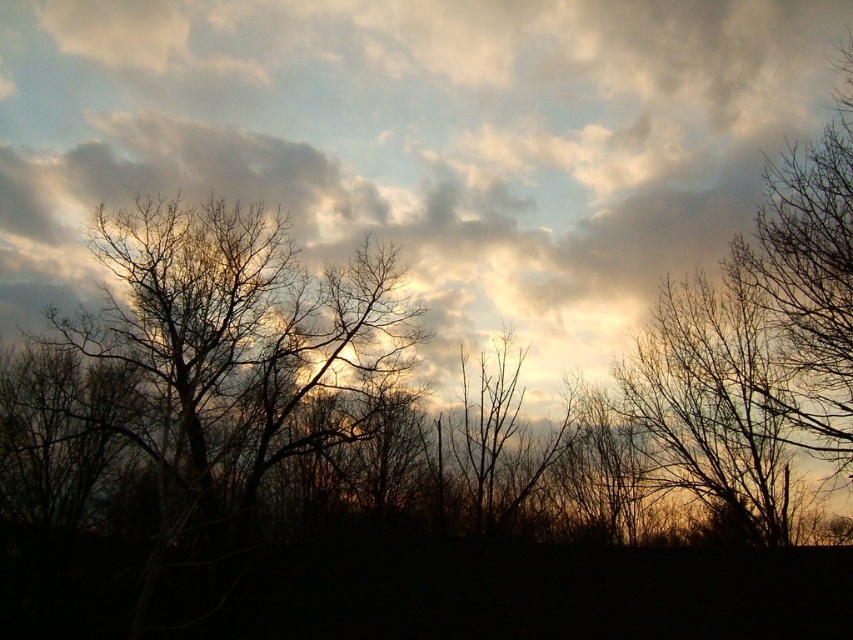
Does cloudy sky at upper center lie behind brown textured tree at right?

Yes, cloudy sky at upper center is further from the viewer.

Between cloudy sky at upper center and brown textured tree at right, which one has more height?

Standing taller between the two is cloudy sky at upper center.

Is point (598, 150) closer to camera compared to point (769, 390)?

No.

The image size is (853, 640). Identify the location of cloudy sky at upper center. (416, 141).

Does brown textured tree at upper right have a greater height compared to brown textured tree at right?

In fact, brown textured tree at upper right may be shorter than brown textured tree at right.

Between brown textured tree at upper right and brown textured tree at right, which one has less height?

With less height is brown textured tree at upper right.

Between point (695, 284) and point (834, 426), which one is positioned behind?

The point (695, 284) is behind.

The image size is (853, 640). Identify the location of brown textured tree at upper right. [711, 404].

Between brown leafless tree at center and brown textured tree at upper right, which one appears on the right side from the viewer's perspective?

brown textured tree at upper right is more to the right.

Which is in front, point (113, 358) or point (735, 520)?

Point (735, 520) is in front.

Who is more forward, (136, 292) or (659, 312)?

Point (659, 312) is in front.

At what (x,y) coordinates should I click in order to perform the action: click on brown leafless tree at center. Please return your answer as a coordinate pair (x, y). Looking at the image, I should click on (236, 342).